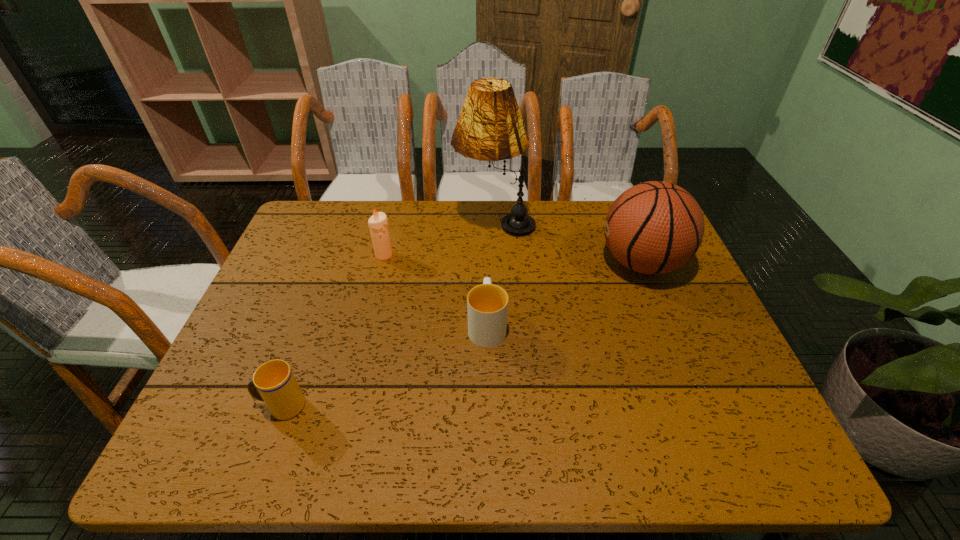
Where is `lampshade present at the far edge`? lampshade present at the far edge is located at coordinates (490, 127).

This screenshot has height=540, width=960. Find the location of `basketball located in the far edge section of the desktop`. basketball located in the far edge section of the desktop is located at coordinates (655, 227).

The height and width of the screenshot is (540, 960). What are the coordinates of `object that is at the near edge` in the screenshot? It's located at (274, 383).

Locate an element on the screen. This screenshot has height=540, width=960. object that is at the left edge is located at coordinates (274, 383).

This screenshot has height=540, width=960. I want to click on object situated at the right edge, so [655, 227].

This screenshot has width=960, height=540. Identify the location of object present at the near left corner. (274, 383).

In order to click on object located in the far right corner section of the desktop in this screenshot , I will do `click(655, 227)`.

Find the location of a particular element. free spot at the far edge of the desktop is located at coordinates (551, 223).

I want to click on vacant point at the near edge, so click(x=560, y=449).

This screenshot has height=540, width=960. I want to click on free space at the left edge of the desktop, so click(306, 261).